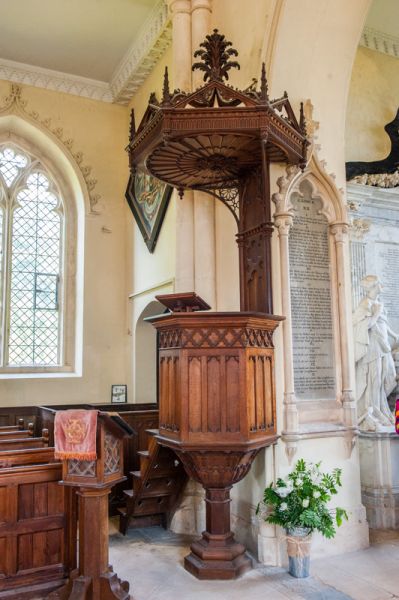
Locate an element on the screen. book is located at coordinates (119, 420).